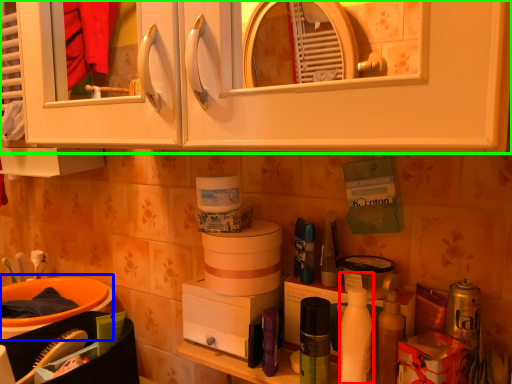
Question: Considering the real-world distances, which object is farthest from cleaning product (highlighted by a red box)? sink (highlighted by a blue box) or cabinetry (highlighted by a green box)?

Choices:
 (A) sink
 (B) cabinetry

Answer: (A)